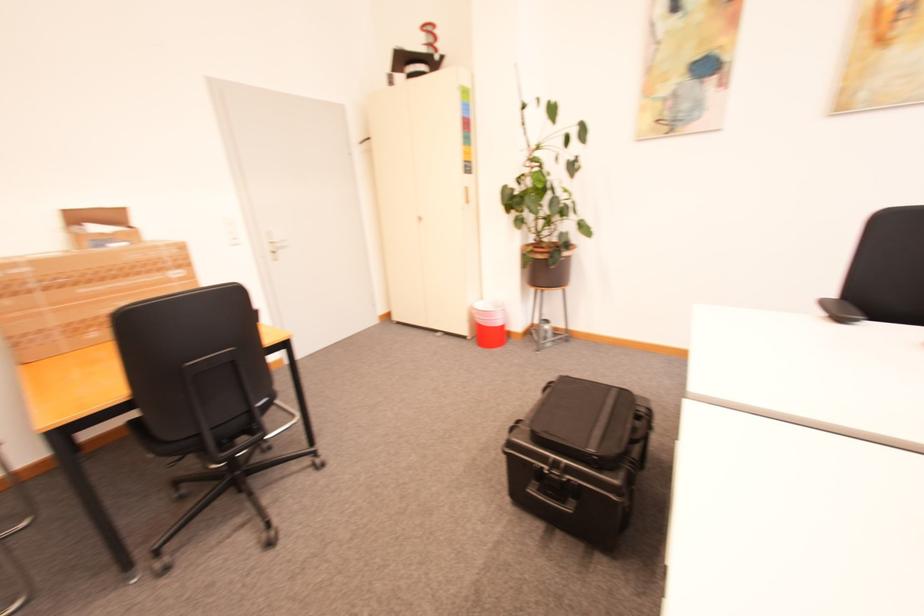
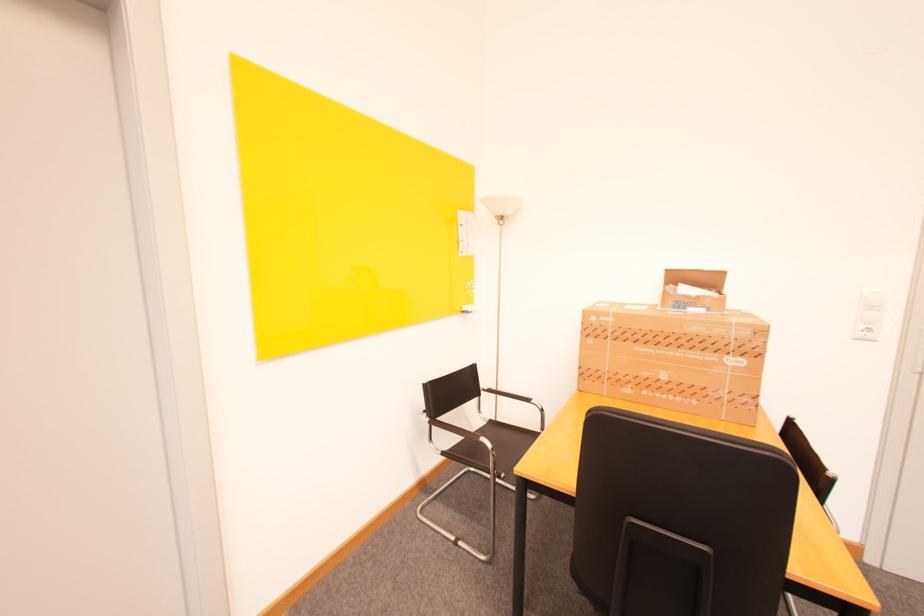
Locate, in the second image, the point that corresponds to point (137, 244) in the first image.

(714, 310)